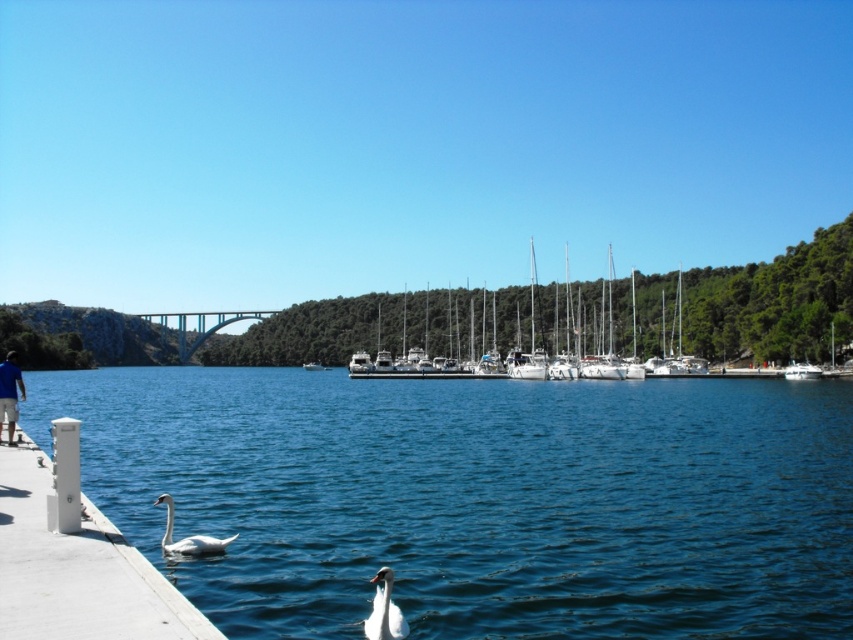
Is point (386, 598) farther from camera compared to point (321, 368)?

No, it is in front of (321, 368).

Is white glossy swan at lower center to the left of white glossy boat at center from the viewer's perspective?

Incorrect, white glossy swan at lower center is not on the left side of white glossy boat at center.

Between point (395, 614) and point (308, 362), which one is positioned behind?

Positioned behind is point (308, 362).

The image size is (853, 640). Identify the location of white glossy swan at lower center. (384, 611).

Between point (404, 548) and point (59, 554), which one is positioned behind?

The point (404, 548) is behind.

Can you confirm if clear blue water at lower center is positioned below white concrete dock at lower left?

Yes.

Does point (316, 632) lie in front of point (33, 632)?

That is False.

This screenshot has height=640, width=853. Find the location of `clear blue water at lower center`. clear blue water at lower center is located at coordinates (479, 499).

Is blue fabric shirt at lower left wider than white matte sailboat at center?

Yes, blue fabric shirt at lower left is wider than white matte sailboat at center.

Who is higher up, blue fabric shirt at lower left or white matte sailboat at center?

blue fabric shirt at lower left

Find the location of a particular element. This screenshot has height=640, width=853. blue fabric shirt at lower left is located at coordinates (9, 394).